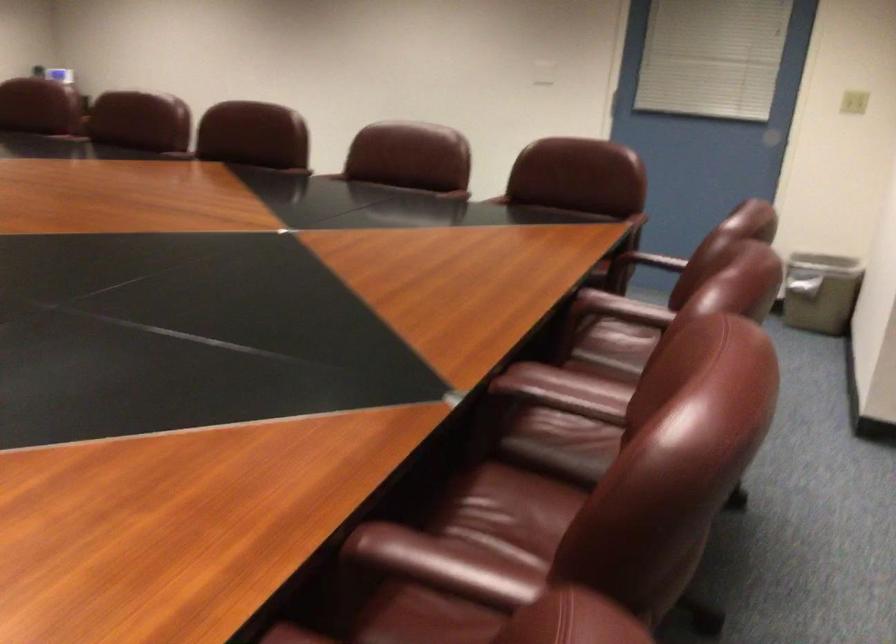
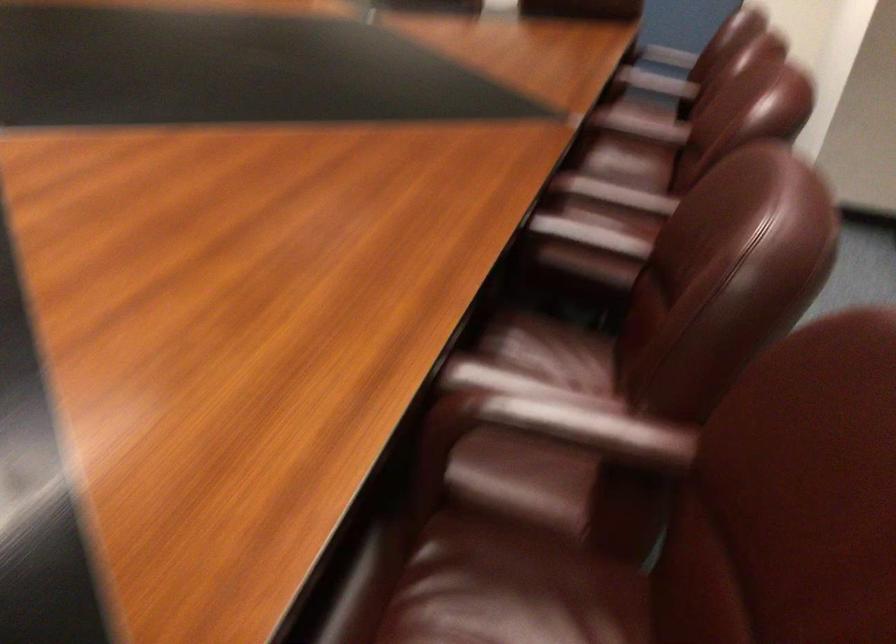
Question: Based on the continuous images, in which direction is the camera rotating? Reply with the corresponding letter.

Choices:
 (A) Left
 (B) Right
 (C) Up
 (D) Down

Answer: (D)